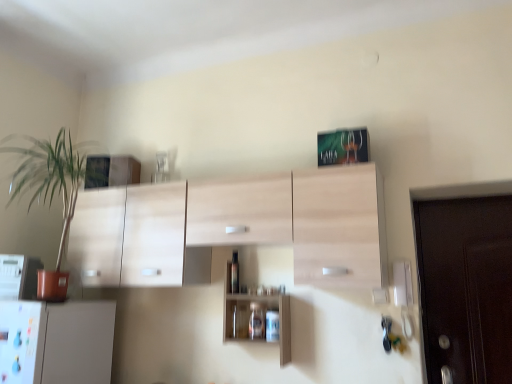
Question: Would you say wooden cabinet at center is to the left or to the right of white plastic microwave at left in the picture?

Choices:
 (A) right
 (B) left

Answer: (A)

Question: Based on their sizes in the image, would you say wooden cabinet at center is bigger or smaller than white plastic microwave at left?

Choices:
 (A) big
 (B) small

Answer: (A)

Question: Which object is the farthest from the wooden cabinet at center?

Choices:
 (A) green leafy plant at left
 (B) white plastic microwave at left
 (C) transparent glass bottle at center

Answer: (A)

Question: Which is farther from the white plastic microwave at left?

Choices:
 (A) wooden cabinet at center
 (B) green leafy plant at left
 (C) transparent glass bottle at center

Answer: (A)